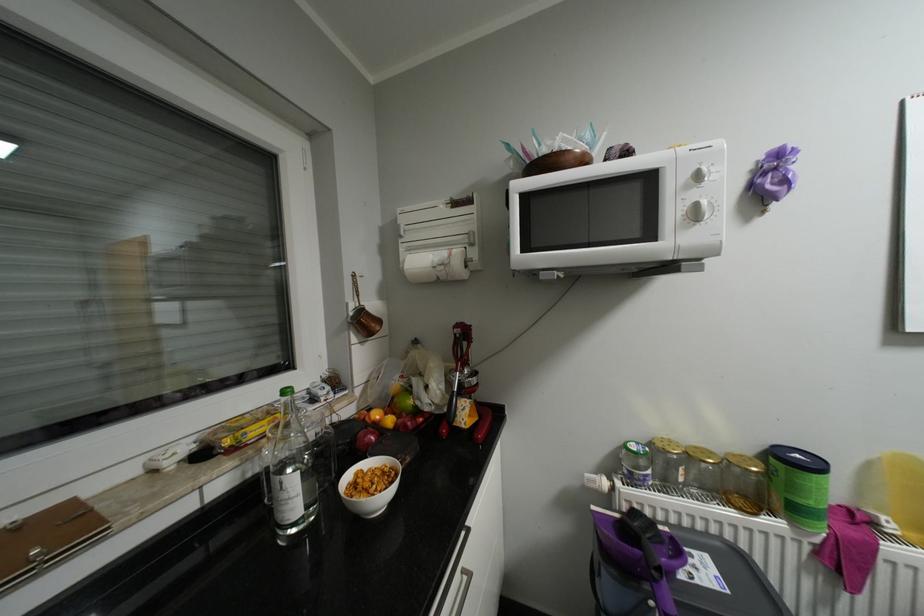
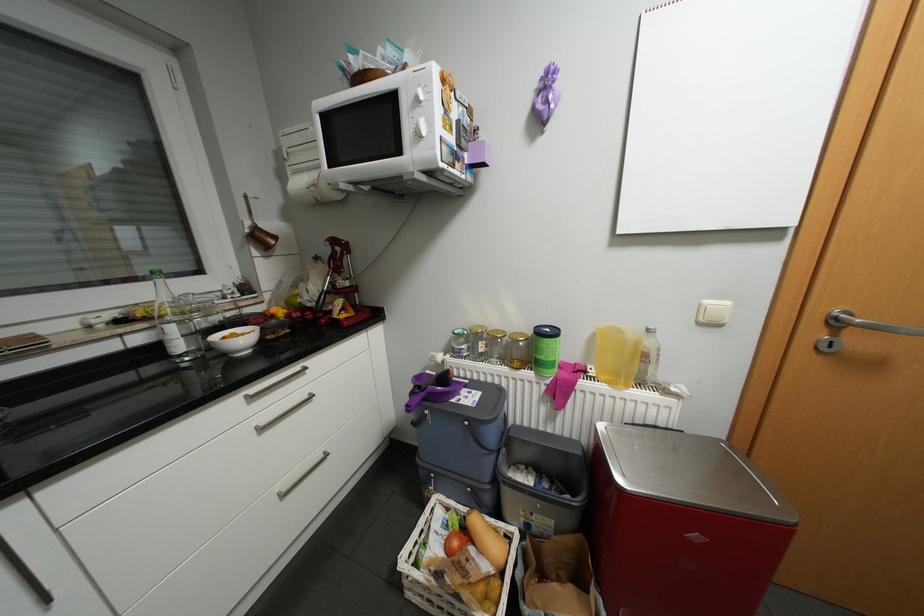
Based on the photo, which direction would the cameraman need to move to produce the second image?

The cameraman walked toward right, backward.